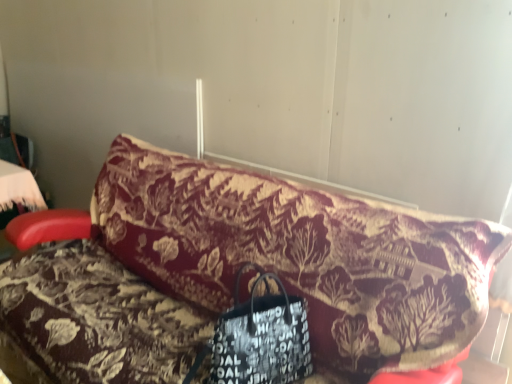
This screenshot has height=384, width=512. What do you see at coordinates (259, 338) in the screenshot? I see `black leather handbag at center` at bounding box center [259, 338].

Where is `black leather handbag at center`? black leather handbag at center is located at coordinates (259, 338).

The height and width of the screenshot is (384, 512). Identify the location of velvet floral-patterned couch at center. 236,272.

What do you see at coordinates (236, 272) in the screenshot? This screenshot has height=384, width=512. I see `velvet floral-patterned couch at center` at bounding box center [236, 272].

The height and width of the screenshot is (384, 512). Find the location of `black leather handbag at center`. black leather handbag at center is located at coordinates (259, 338).

Between velvet floral-patterned couch at center and black leather handbag at center, which one appears on the left side from the viewer's perspective?

From the viewer's perspective, velvet floral-patterned couch at center appears more on the left side.

Does velvet floral-patterned couch at center come in front of black leather handbag at center?

Yes, it is.

Considering the positions of points (191, 159) and (276, 316), is point (191, 159) closer to camera compared to point (276, 316)?

No, it is behind (276, 316).

From the image's perspective, is velvet floral-patterned couch at center located above or below black leather handbag at center?

From the image's perspective, velvet floral-patterned couch at center appears above black leather handbag at center.

From a real-world perspective, is velvet floral-patterned couch at center located beneath black leather handbag at center?

Yes.

Considering the relative sizes of velvet floral-patterned couch at center and black leather handbag at center in the image provided, is velvet floral-patterned couch at center thinner than black leather handbag at center?

No.

Between velvet floral-patterned couch at center and black leather handbag at center, which one has less height?

black leather handbag at center is shorter.

Is velvet floral-patterned couch at center bigger or smaller than black leather handbag at center?

Clearly, velvet floral-patterned couch at center is larger in size than black leather handbag at center.

Is velvet floral-patterned couch at center positioned beyond the bounds of black leather handbag at center?

Yes, velvet floral-patterned couch at center is not within black leather handbag at center.

Is velvet floral-patterned couch at center placed right next to black leather handbag at center?

There is a gap between velvet floral-patterned couch at center and black leather handbag at center.

Based on the photo, is velvet floral-patterned couch at center aimed at black leather handbag at center?

Yes, velvet floral-patterned couch at center is oriented towards black leather handbag at center.

How different are the orientations of velvet floral-patterned couch at center and black leather handbag at center in degrees?

78.6 degrees separate the facing orientations of velvet floral-patterned couch at center and black leather handbag at center.

Locate an element on the screen. Image resolution: width=512 pixels, height=384 pixels. handbag above the velvet floral-patterned couch at center (from a real-world perspective) is located at coordinates (259, 338).

Can you confirm if black leather handbag at center is positioned to the left of velvet floral-patterned couch at center?

In fact, black leather handbag at center is to the right of velvet floral-patterned couch at center.

Is black leather handbag at center in front of or behind velvet floral-patterned couch at center in the image?

In the image, black leather handbag at center appears behind velvet floral-patterned couch at center.

Does point (243, 319) appear closer or farther from the camera than point (231, 276)?

Clearly, point (243, 319) is closer to the camera than point (231, 276).

From the image's perspective, which one is positioned higher, black leather handbag at center or velvet floral-patterned couch at center?

From the image's view, velvet floral-patterned couch at center is above.

From a real-world perspective, is black leather handbag at center above or below velvet floral-patterned couch at center?

In terms of real-world spatial position, black leather handbag at center is above velvet floral-patterned couch at center.

Considering the sizes of objects black leather handbag at center and velvet floral-patterned couch at center in the image provided, who is thinner, black leather handbag at center or velvet floral-patterned couch at center?

black leather handbag at center.

Considering the sizes of black leather handbag at center and velvet floral-patterned couch at center in the image, is black leather handbag at center taller or shorter than velvet floral-patterned couch at center?

black leather handbag at center is shorter than velvet floral-patterned couch at center.

Considering the sizes of black leather handbag at center and velvet floral-patterned couch at center in the image, is black leather handbag at center bigger or smaller than velvet floral-patterned couch at center?

black leather handbag at center is smaller than velvet floral-patterned couch at center.

Is velvet floral-patterned couch at center completely or partially inside black leather handbag at center?

Definitely not — velvet floral-patterned couch at center is not inside black leather handbag at center.

Are black leather handbag at center and velvet floral-patterned couch at center far apart?

No, there isn't a large distance between black leather handbag at center and velvet floral-patterned couch at center.

Is black leather handbag at center oriented towards velvet floral-patterned couch at center?

Yes, black leather handbag at center faces towards velvet floral-patterned couch at center.

The image size is (512, 384). In the image, there is a black leather handbag at center. In order to click on furniture below it (from a real-world perspective) in this screenshot , I will do `click(236, 272)`.

The height and width of the screenshot is (384, 512). I want to click on furniture in front of the black leather handbag at center, so click(236, 272).

Where is `handbag to the right of velvet floral-patterned couch at center`? The image size is (512, 384). handbag to the right of velvet floral-patterned couch at center is located at coordinates (259, 338).